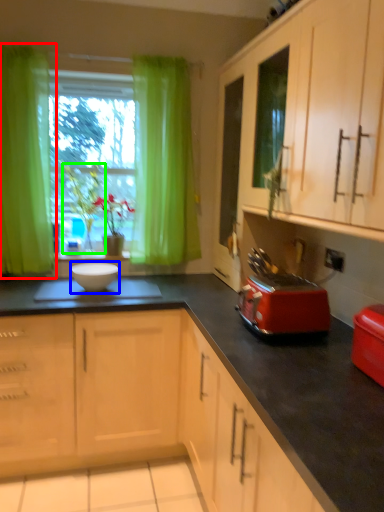
Question: Which object is the closest to the curtain (highlighted by a red box)? Choose among these: mixing bowl (highlighted by a blue box) or plant (highlighted by a green box).

Choices:
 (A) mixing bowl
 (B) plant

Answer: (B)